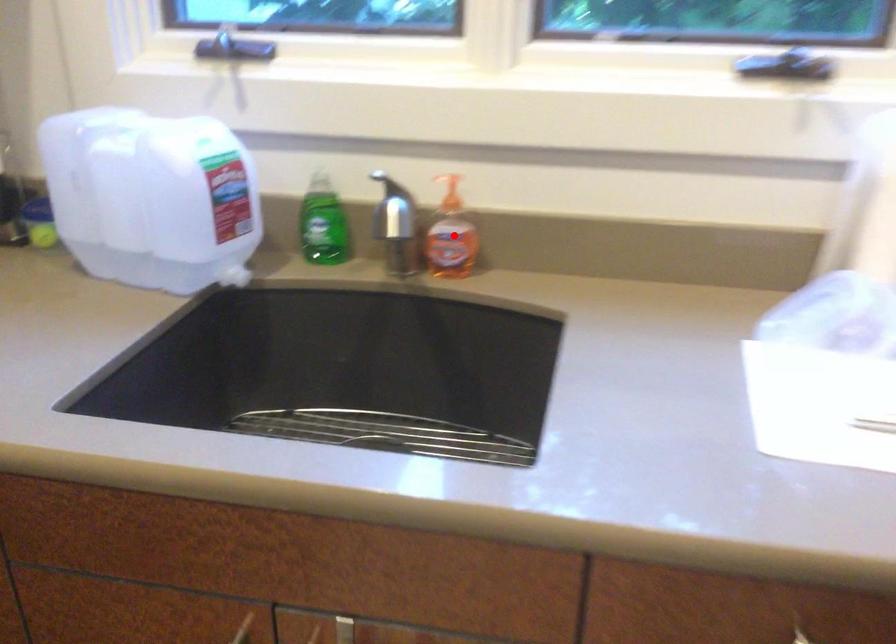
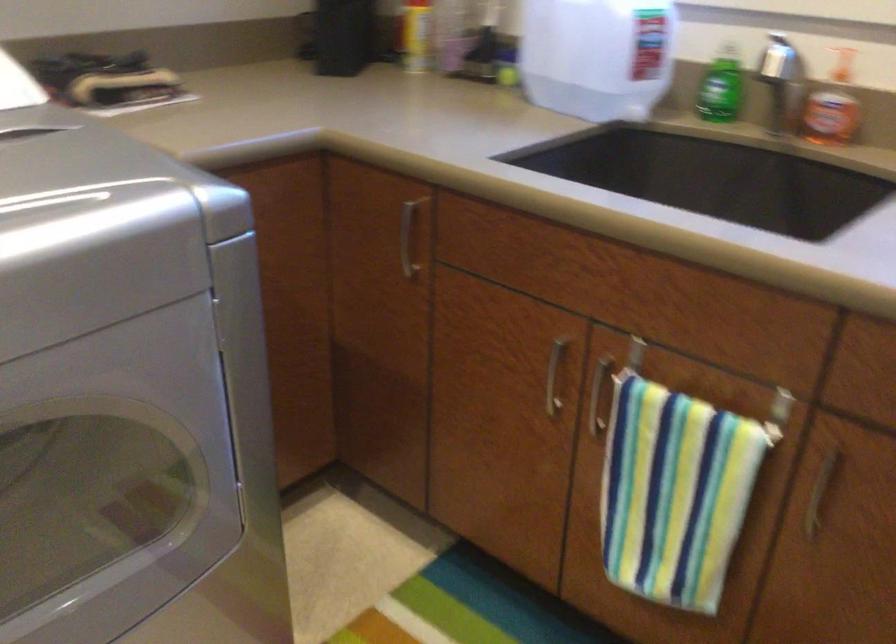
Where in the second image is the point corresponding to the highlighted location from the first image?

(832, 106)